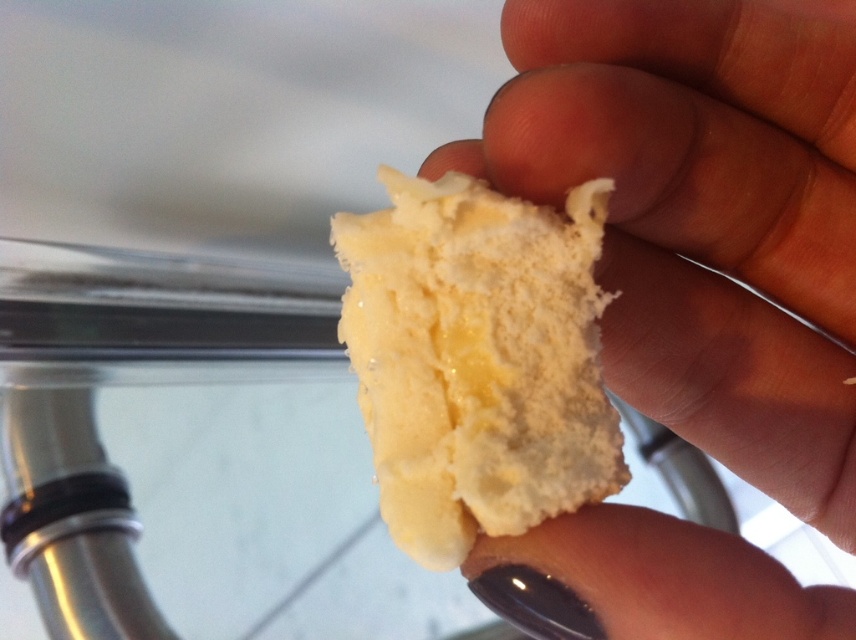
Question: Does white fluffy sponge at center have a greater width compared to yellow creamy sponge at center?

Choices:
 (A) yes
 (B) no

Answer: (A)

Question: Which point is farther to the camera?

Choices:
 (A) (569, 387)
 (B) (661, 353)

Answer: (B)

Question: Which point is closer to the camera?

Choices:
 (A) (455, 497)
 (B) (717, 10)

Answer: (A)

Question: Does white fluffy sponge at center have a lesser width compared to yellow creamy sponge at center?

Choices:
 (A) yes
 (B) no

Answer: (B)

Question: Which of the following is the closest to the observer?

Choices:
 (A) (609, 326)
 (B) (406, 336)

Answer: (B)

Question: Can you confirm if white fluffy sponge at center is positioned above yellow creamy sponge at center?

Choices:
 (A) no
 (B) yes

Answer: (A)